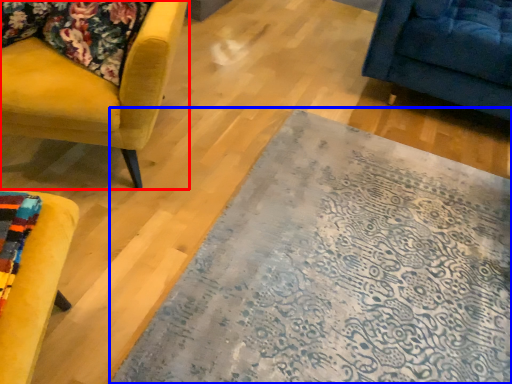
Question: Which object appears closest to the camera in this image, chair (highlighted by a red box) or mat (highlighted by a blue box)?

Choices:
 (A) chair
 (B) mat

Answer: (B)